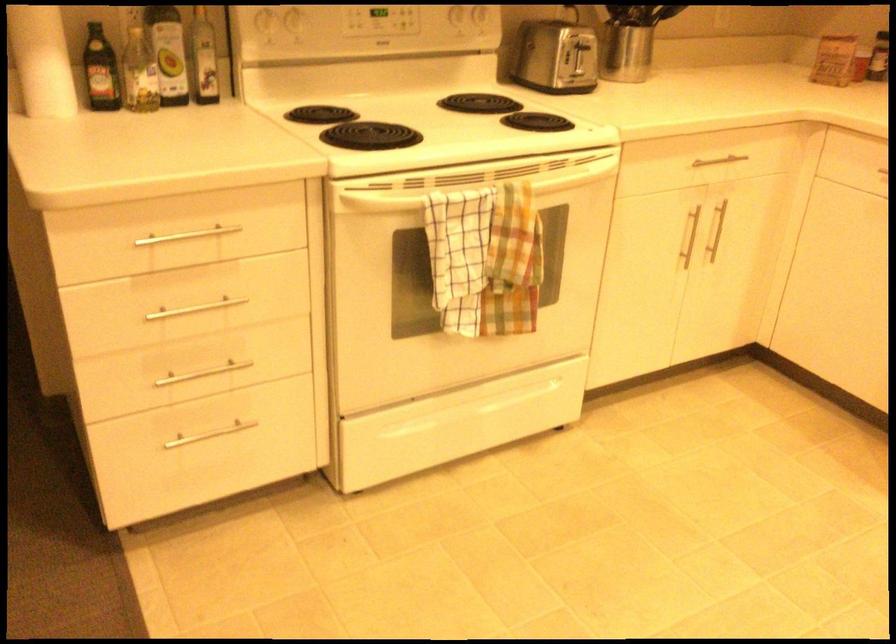
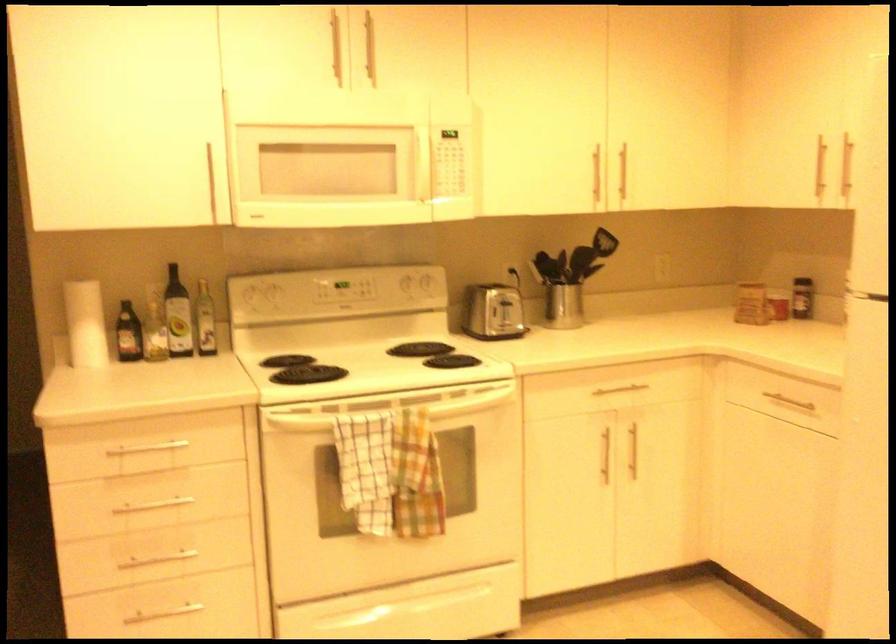
The images are taken continuously from a first-person perspective. In which direction are you moving?

The cameraman walked toward right, backward.